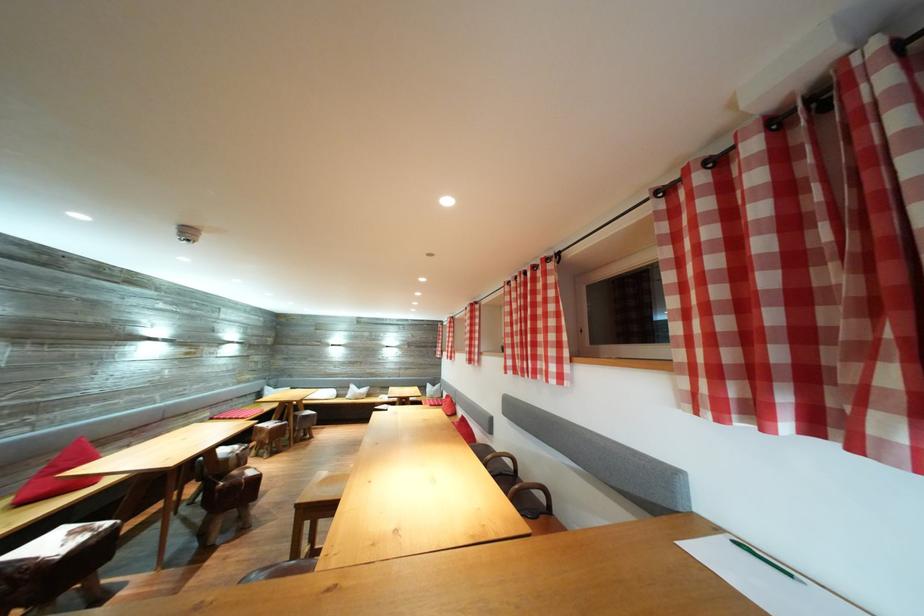
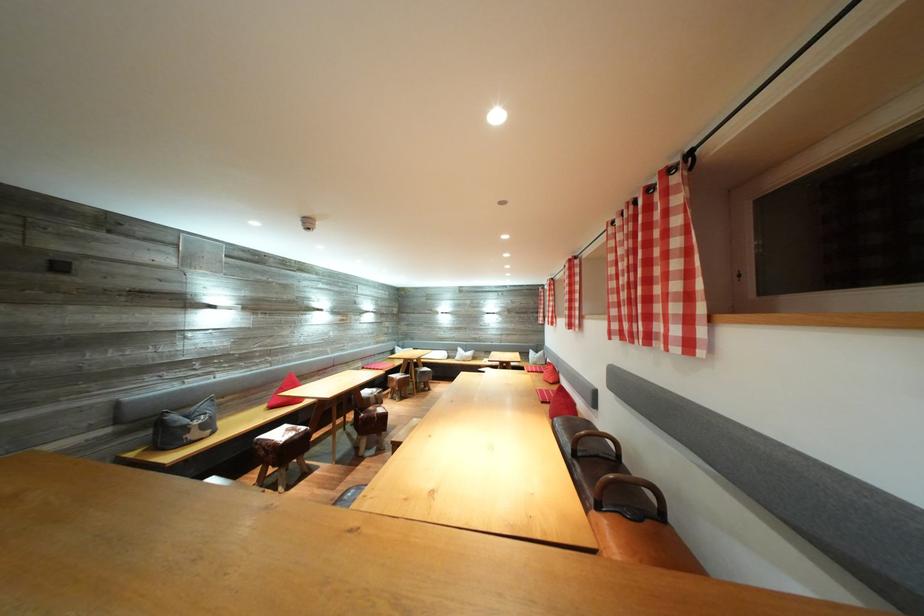
Locate, in the second image, the point that corresponds to pixel 452 325 in the first image.

(553, 288)